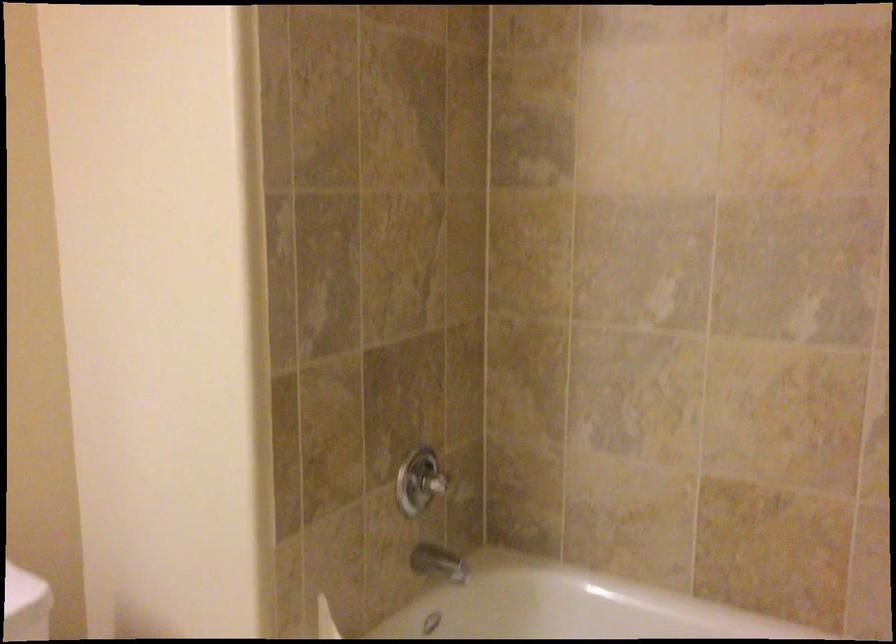
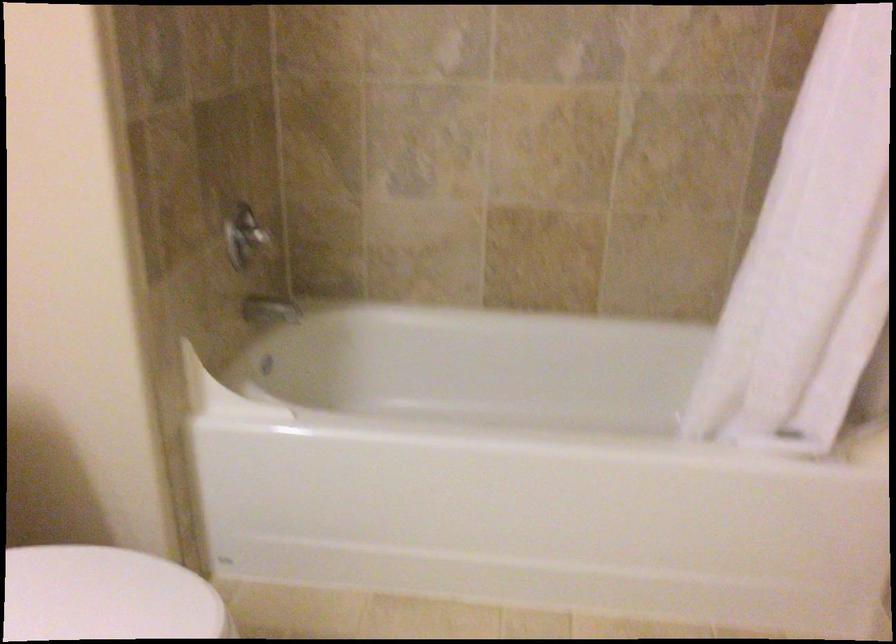
Question: Based on the continuous images, in which direction is the camera rotating? Reply with the corresponding letter.

Choices:
 (A) Left
 (B) Right
 (C) Up
 (D) Down

Answer: (B)